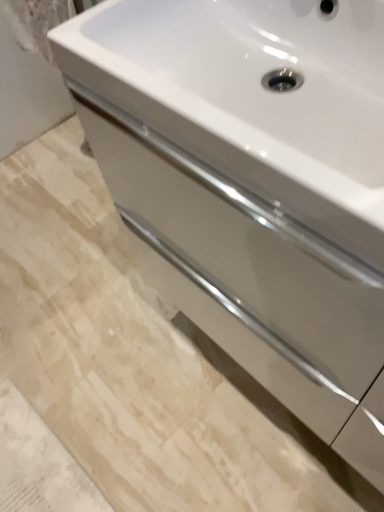
You are a GUI agent. You are given a task and a screenshot of the screen. Output one action in this format:
    pyautogui.click(x=<x>, y=<y>)
    Task: Click on the white glossy sink at upper center
    
    Given the screenshot: What is the action you would take?
    pyautogui.click(x=250, y=90)

This screenshot has width=384, height=512. Describe the element at coordinates (250, 90) in the screenshot. I see `white glossy sink at upper center` at that location.

Identify the location of white glossy sink at upper center. (250, 90).